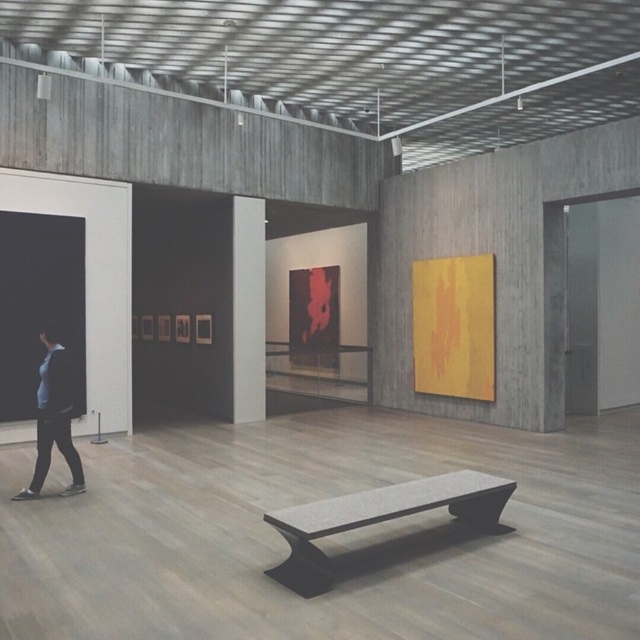
You are standing in the art gallery and notice two points marked on the wall. The first point is at coordinates point (400, 486) and the second is at point (81, 483). Which point is closer to your current position as you stand in the gallery?

Point (400, 486) is closer to the camera than point (81, 483), so the first point is closer to your current position.